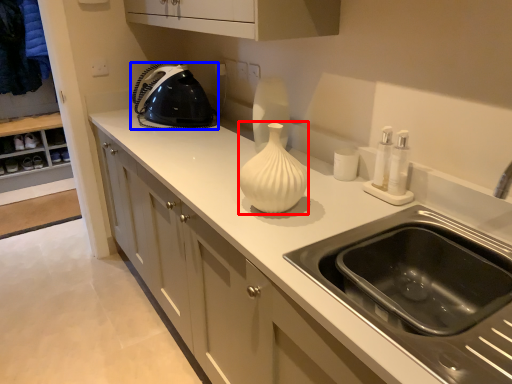
Question: Which object is further to the camera taking this photo, vase (highlighted by a red box) or home appliance (highlighted by a blue box)?

Choices:
 (A) vase
 (B) home appliance

Answer: (B)